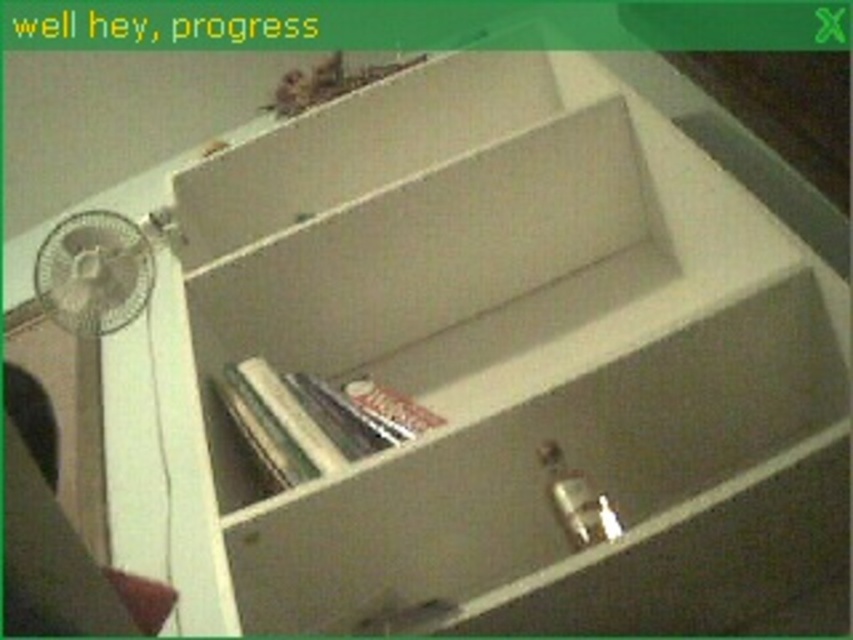
You are standing in front of the shelf and want to place a small object on the shelf. There are two points marked on the shelf where you can place it. Which point is closer to you, point (422, 417) or point (97, 250)?

Point (422, 417) is in front of point (97, 250), so placing the object at point (422, 417) would be closer to you.

You are organizing items on a shelf and need to place both the hardcover book at center and the metallic silver fan at left. Since the shelf has limited vertical space, which item should you place first to ensure both fit vertically?

The hardcover book at center has a lesser height compared to metallic silver fan at left, so place the metallic silver fan at left first to accommodate its greater height before placing the hardcover book at center.

You are organizing items on a shelf and need to place a new item. Where is the hardcover book at center located on the shelf unit?

The hardcover book at center is located at point coordinates of (315, 419) on the shelf unit.